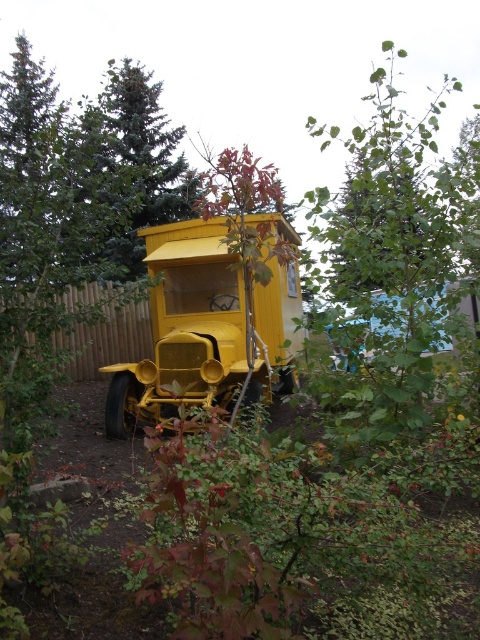
Looking at this image, does green leafy tree at upper center have a greater height compared to matte yellow car at center?

Yes, green leafy tree at upper center is taller than matte yellow car at center.

Which of these two, green leafy tree at upper center or matte yellow car at center, stands shorter?

matte yellow car at center

Locate an element on the screen. This screenshot has height=640, width=480. green leafy tree at upper center is located at coordinates (392, 237).

The image size is (480, 640). Describe the element at coordinates (183, 328) in the screenshot. I see `matte yellow car at center` at that location.

Is point (157, 337) more distant than point (80, 358)?

No, (157, 337) is in front of (80, 358).

At what (x,y) coordinates should I click in order to perform the action: click on matte yellow car at center. Please return your answer as a coordinate pair (x, y). Looking at the image, I should click on (183, 328).

Who is positioned more to the right, green textured tree at upper left or brown wooden fence at left?

brown wooden fence at left is more to the right.

Between point (123, 237) and point (104, 314), which one is positioned behind?

Positioned behind is point (123, 237).

Between point (118, 253) and point (120, 288), which one is positioned behind?

The point (118, 253) is behind.

Locate an element on the screen. The width and height of the screenshot is (480, 640). green textured tree at upper left is located at coordinates (132, 166).